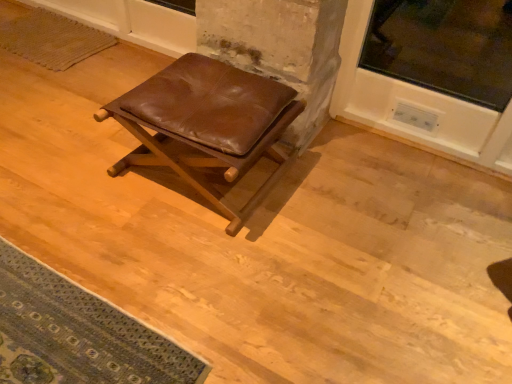
Find the location of a particular element. The image size is (512, 384). vacant area situated to the left side of brown leather stool at center is located at coordinates click(x=70, y=169).